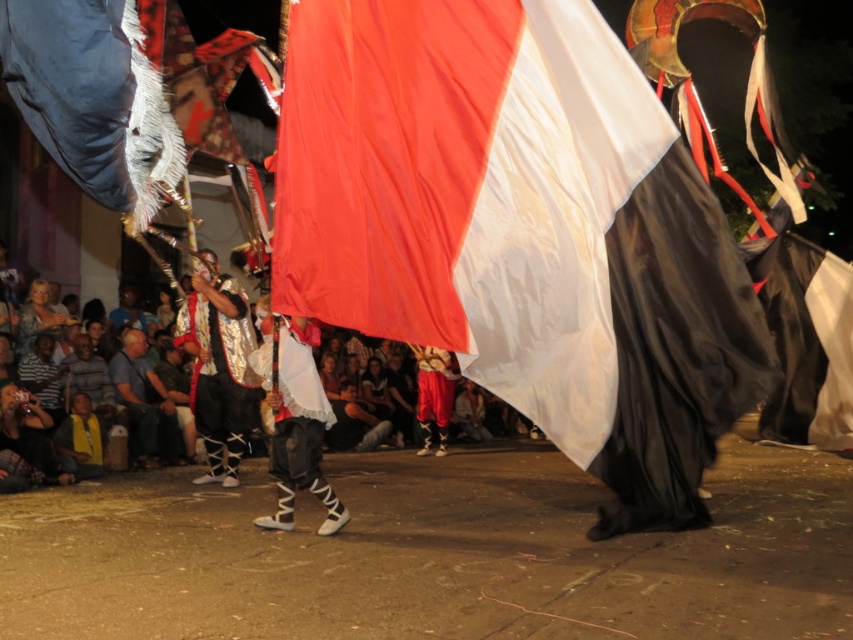
Question: Is shiny metallic robe at center below white matte pants at center?

Choices:
 (A) yes
 (B) no

Answer: (B)

Question: Which of the following is the farthest from the observer?

Choices:
 (A) (563, 134)
 (B) (225, 323)
 (C) (276, 397)
 (D) (61, 324)

Answer: (D)

Question: Which object is positioned farthest from the shiny metallic robe at center?

Choices:
 (A) golden textured sweater at lower left
 (B) white matte pants at center
 (C) silky red-white flag at center

Answer: (C)

Question: Does silky red-white flag at center appear under white matte pants at center?

Choices:
 (A) yes
 (B) no

Answer: (B)

Question: Does shiny metallic robe at center have a greater width compared to white matte pants at center?

Choices:
 (A) no
 (B) yes

Answer: (B)

Question: Which object appears closest to the camera in this image?

Choices:
 (A) white matte pants at center
 (B) silky red-white flag at center
 (C) shiny metallic robe at center

Answer: (B)